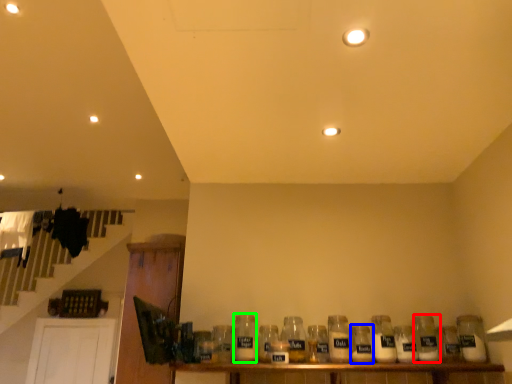
Question: Based on their relative distances, which object is nearer to bottle (highlighted by a red box)? Choose from bottle (highlighted by a blue box) and bottle (highlighted by a green box).

Choices:
 (A) bottle
 (B) bottle

Answer: (A)